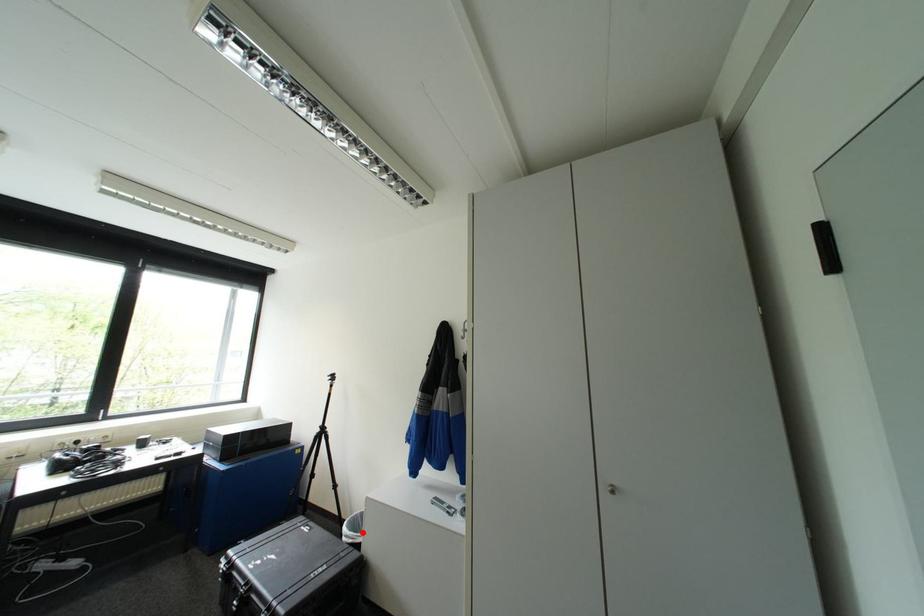
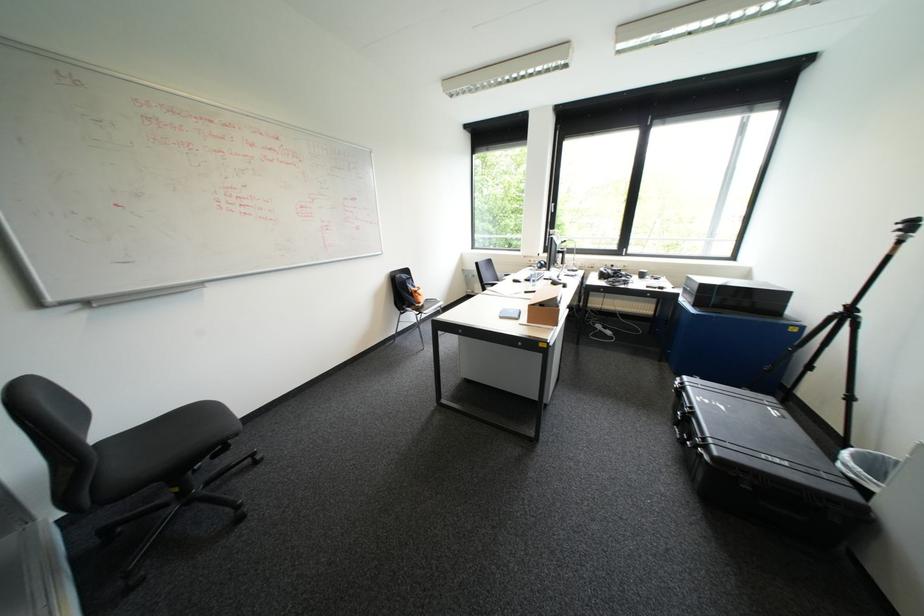
Question: I am providing you with two images of the same scene from different viewpoints. A red point is shown in image1. For the corresponding object point in image2, is it positioned nearer or farther from the camera?

Choices:
 (A) Nearer
 (B) Farther

Answer: (B)